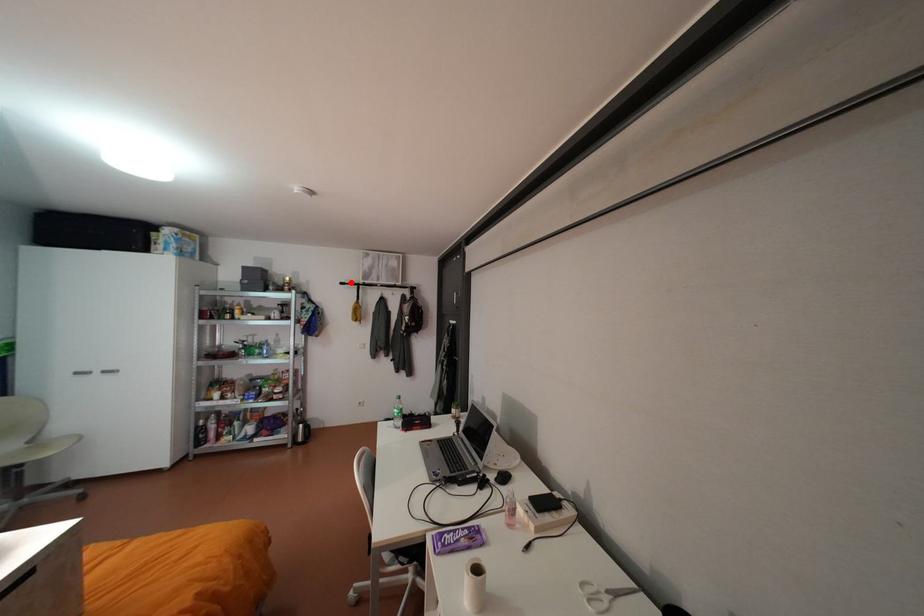
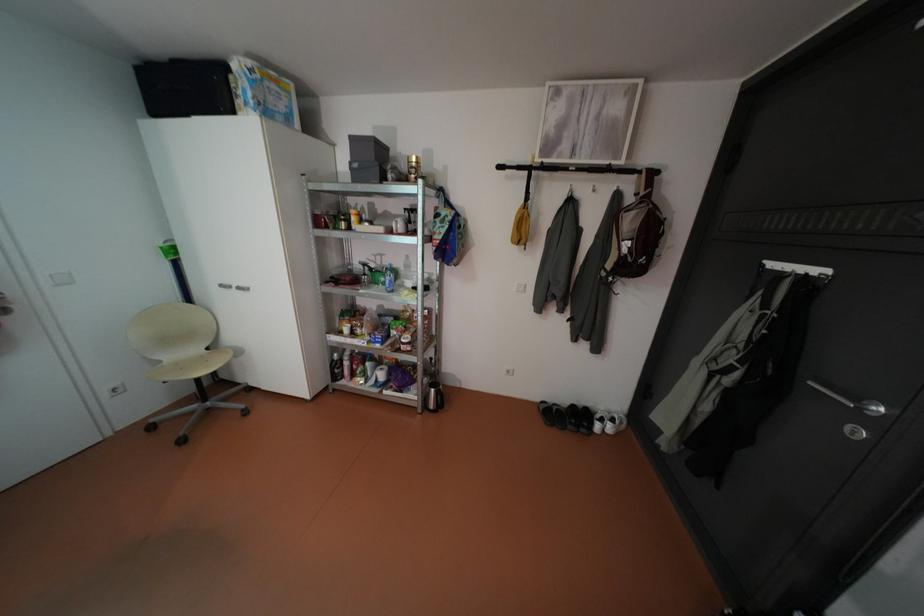
Locate, in the second image, the point that corresponds to the highlighted location in the first image.

(508, 166)